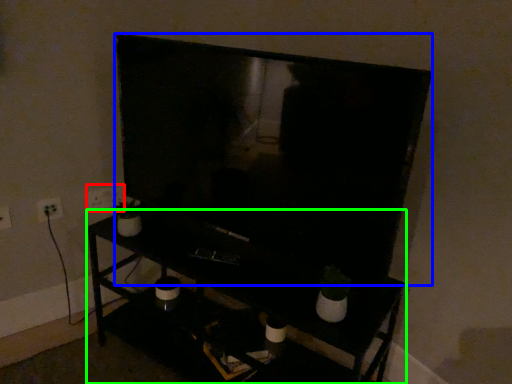
Question: Which object is positioned closest to electric outlet (highlighted by a red box)? Select from television (highlighted by a blue box) and furniture (highlighted by a green box).

Choices:
 (A) television
 (B) furniture

Answer: (B)